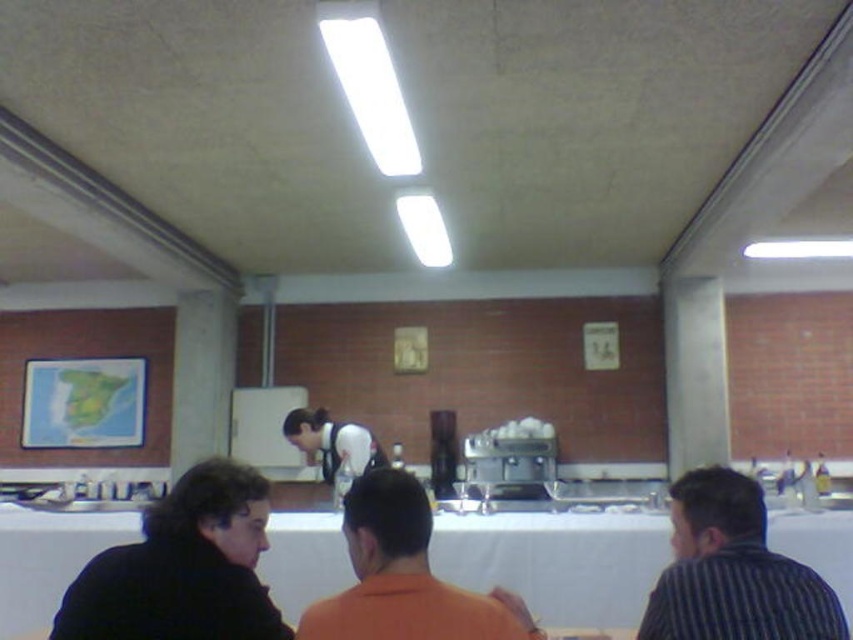
Question: Which of the following is the closest to the observer?

Choices:
 (A) striped shirt at right
 (B) white fabric table at lower center
 (C) black fabric at lower left

Answer: (C)

Question: Does white fabric table at lower center have a lesser width compared to white fabric apron at center?

Choices:
 (A) no
 (B) yes

Answer: (A)

Question: Can you confirm if white fabric table at lower center is positioned below black fabric at lower left?

Choices:
 (A) yes
 (B) no

Answer: (A)

Question: Among these points, which one is farthest from the camera?

Choices:
 (A) (71, 604)
 (B) (305, 424)

Answer: (B)

Question: Which object appears farthest from the camera in this image?

Choices:
 (A) striped shirt at right
 (B) black fabric at lower left

Answer: (A)

Question: Does white fabric table at lower center have a lesser width compared to orange matte shirt at center?

Choices:
 (A) yes
 (B) no

Answer: (B)